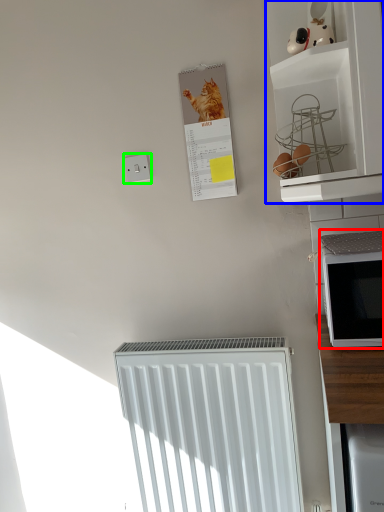
Question: Which is nearer to the microwave oven (highlighted by a red box)? shelf (highlighted by a blue box) or electric outlet (highlighted by a green box).

Choices:
 (A) shelf
 (B) electric outlet

Answer: (A)